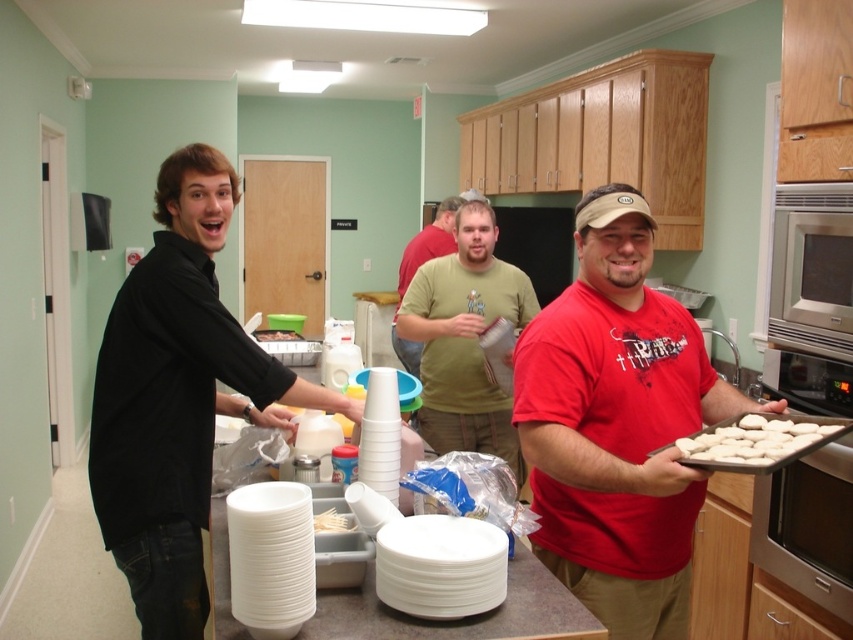
Looking at this image, does red matte shirt at center have a smaller size compared to green plastic container at center?

No, red matte shirt at center is not smaller than green plastic container at center.

Describe the element at coordinates (618, 426) in the screenshot. I see `red matte shirt at center` at that location.

Locate an element on the screen. This screenshot has height=640, width=853. red matte shirt at center is located at coordinates (618, 426).

Who is more forward, (596, 304) or (390, 330)?

Point (596, 304) is in front.

Is the position of red matte shirt at center less distant than that of green matte shirt at center?

Yes.

Is point (564, 428) closer to camera compared to point (398, 342)?

Yes, point (564, 428) is in front of point (398, 342).

The height and width of the screenshot is (640, 853). Find the location of `red matte shirt at center`. red matte shirt at center is located at coordinates (618, 426).

Which is more to the left, green matte shirt at center or white plastic forks at center?

From the viewer's perspective, white plastic forks at center appears more on the left side.

Measure the distance between point (410,244) and camera.

A distance of 4.95 meters exists between point (410,244) and camera.

Who is more forward, (408, 360) or (326, 513)?

Point (326, 513) is more forward.

Find the location of a particular element. The height and width of the screenshot is (640, 853). green matte shirt at center is located at coordinates (418, 266).